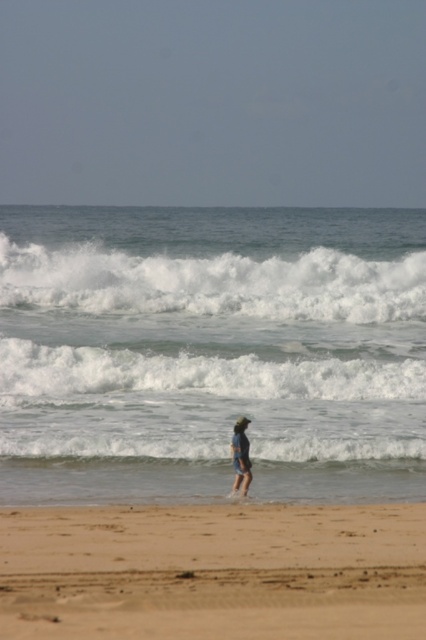
Between white foamy wave at upper center and blue denim shorts at center, which one has less height?

blue denim shorts at center

Who is lower down, white foamy wave at upper center or blue denim shorts at center?

blue denim shorts at center is lower down.

Does point (278, 252) come in front of point (242, 468)?

No, (278, 252) is behind (242, 468).

What are the coordinates of `white foamy wave at upper center` in the screenshot? It's located at (210, 278).

Based on the photo, is white foamy water at center to the left of sandy beach at lower center from the viewer's perspective?

In fact, white foamy water at center is to the right of sandy beach at lower center.

Does point (120, 268) come farther from viewer compared to point (294, 529)?

Yes, it is behind point (294, 529).

Find the location of a particular element. white foamy water at center is located at coordinates (210, 352).

Based on the photo, does white foamy water at center have a lesser height compared to white foamy wave at center?

No.

Is point (176, 449) positioned after point (124, 394)?

No, (176, 449) is in front of (124, 394).

I want to click on white foamy water at center, so click(210, 352).